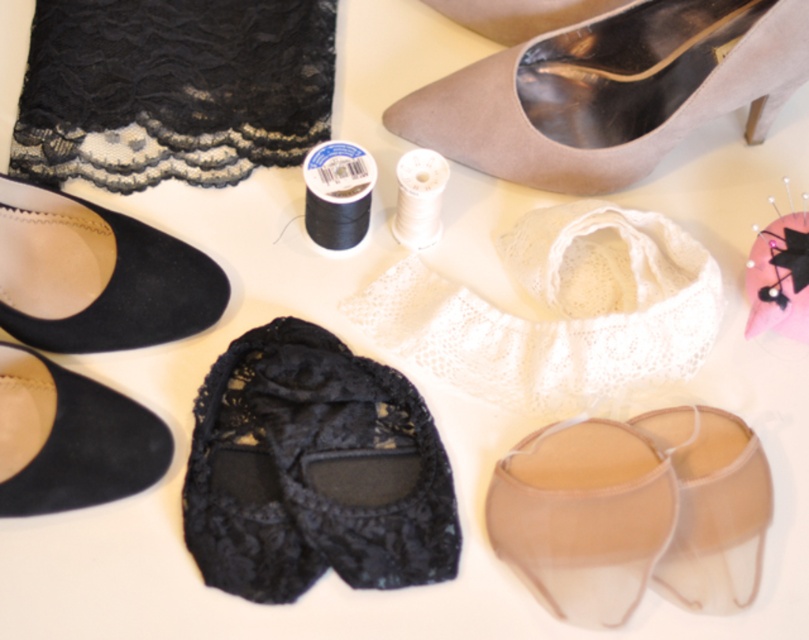
Question: Does suede shoe at lower left have a lesser width compared to translucent beige sandal at lower right?

Choices:
 (A) no
 (B) yes

Answer: (A)

Question: Among these points, which one is farthest from the camera?

Choices:
 (A) (733, 493)
 (B) (153, 230)
 (C) (106, 472)
 (D) (431, 508)

Answer: (B)

Question: Which is farther from the translucent beige sandal at lower right?

Choices:
 (A) black lace slipper at center
 (B) transparent beige sandal at lower right
 (C) suede black shoe at lower left

Answer: (C)

Question: Can you confirm if black lace slipper at center is positioned above suede black shoe at lower left?

Choices:
 (A) no
 (B) yes

Answer: (A)

Question: Which point is closer to the camera?

Choices:
 (A) (125, 243)
 (B) (570, 26)
 (C) (452, 513)

Answer: (C)

Question: Can you confirm if suede shoe at lower left is smaller than translucent beige sandal at lower right?

Choices:
 (A) no
 (B) yes

Answer: (A)